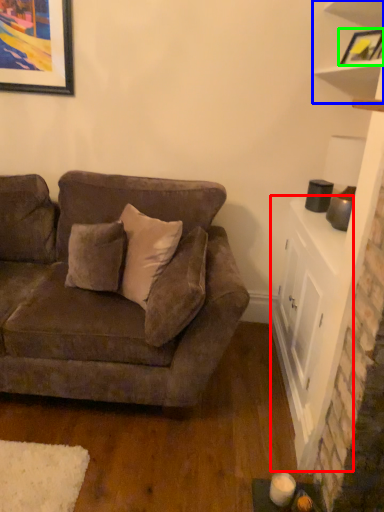
Question: Considering the real-world distances, which object is closest to table (highlighted by a red box)? shelf (highlighted by a blue box) or picture frame (highlighted by a green box).

Choices:
 (A) shelf
 (B) picture frame

Answer: (A)